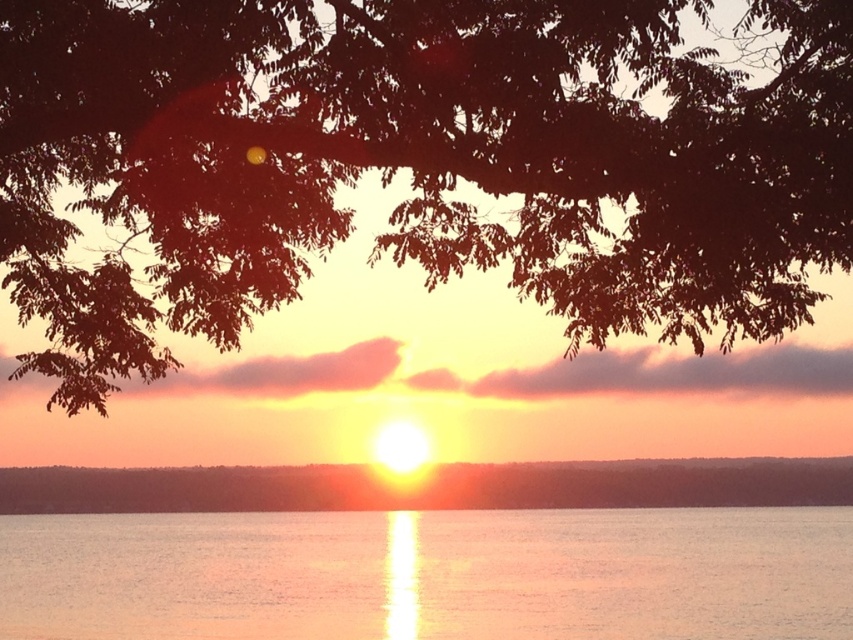
Can you confirm if dark brown leafy branches at upper center is taller than smooth orange sky at center?

Correct, dark brown leafy branches at upper center is much taller as smooth orange sky at center.

Is dark brown leafy branches at upper center closer to camera compared to smooth orange sky at center?

Yes, it is in front of smooth orange sky at center.

What do you see at coordinates (415, 163) in the screenshot? The height and width of the screenshot is (640, 853). I see `dark brown leafy branches at upper center` at bounding box center [415, 163].

Locate an element on the screen. The width and height of the screenshot is (853, 640). dark brown leafy branches at upper center is located at coordinates 415,163.

Is reflective silver water at center below smooth orange sky at center?

Indeed, reflective silver water at center is positioned under smooth orange sky at center.

Measure the distance between point [851,570] and camera.

Point [851,570] and camera are 34.62 meters apart from each other.

The image size is (853, 640). I want to click on reflective silver water at center, so click(430, 576).

Can you confirm if dark brown leafy branches at upper center is shorter than reflective silver water at center?

In fact, dark brown leafy branches at upper center may be taller than reflective silver water at center.

Is dark brown leafy branches at upper center to the right of reflective silver water at center from the viewer's perspective?

No, dark brown leafy branches at upper center is not to the right of reflective silver water at center.

Identify the location of dark brown leafy branches at upper center. (415, 163).